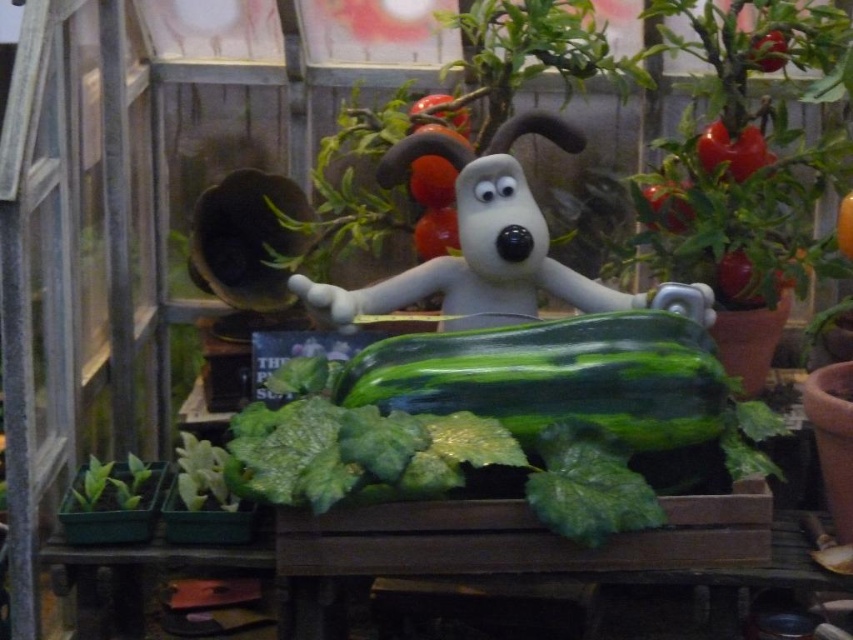
Question: Is green matte cucumber at center behind green leafy at lower left?

Choices:
 (A) no
 (B) yes

Answer: (B)

Question: Considering the real-world distances, which object is closest to the white matte dog at center?

Choices:
 (A) green leafy at lower left
 (B) green matte cucumber at center

Answer: (B)

Question: Which point appears closest to the camera in this image?

Choices:
 (A) (190, 468)
 (B) (344, 316)

Answer: (A)

Question: Where is green matte cucumber at center located in relation to green leafy at lower left in the image?

Choices:
 (A) left
 (B) right

Answer: (B)

Question: Does white matte dog at center have a smaller size compared to green leafy at lower left?

Choices:
 (A) no
 (B) yes

Answer: (A)

Question: Which object appears closest to the camera in this image?

Choices:
 (A) green matte cucumber at center
 (B) white matte dog at center

Answer: (A)